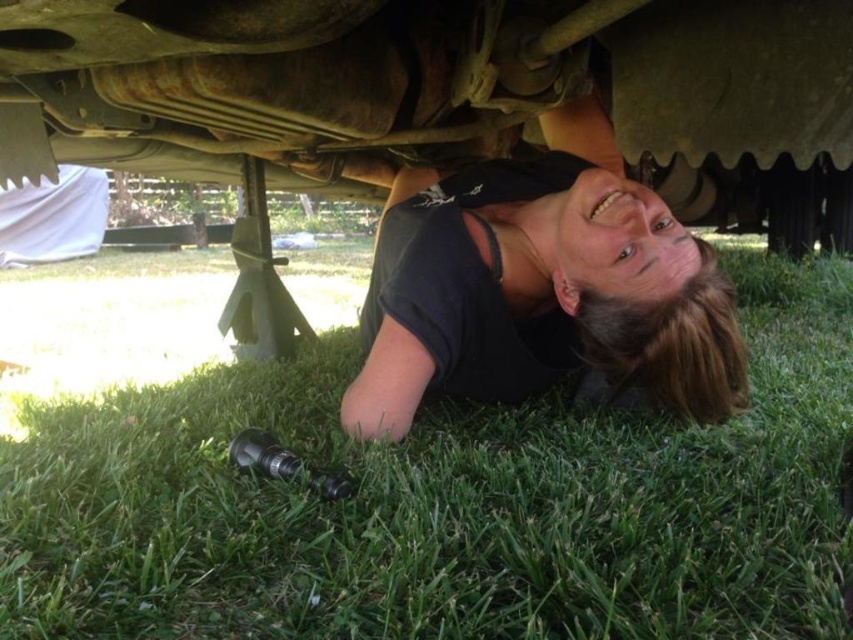
Does green grass at lower center come behind black matte shirt at lower center?

No, green grass at lower center is closer to the viewer.

Is green grass at lower center bigger than black matte shirt at lower center?

Correct, green grass at lower center is larger in size than black matte shirt at lower center.

Is point (780, 540) less distant than point (654, 218)?

That is True.

What are the coordinates of `green grass at lower center` in the screenshot? It's located at (x=445, y=502).